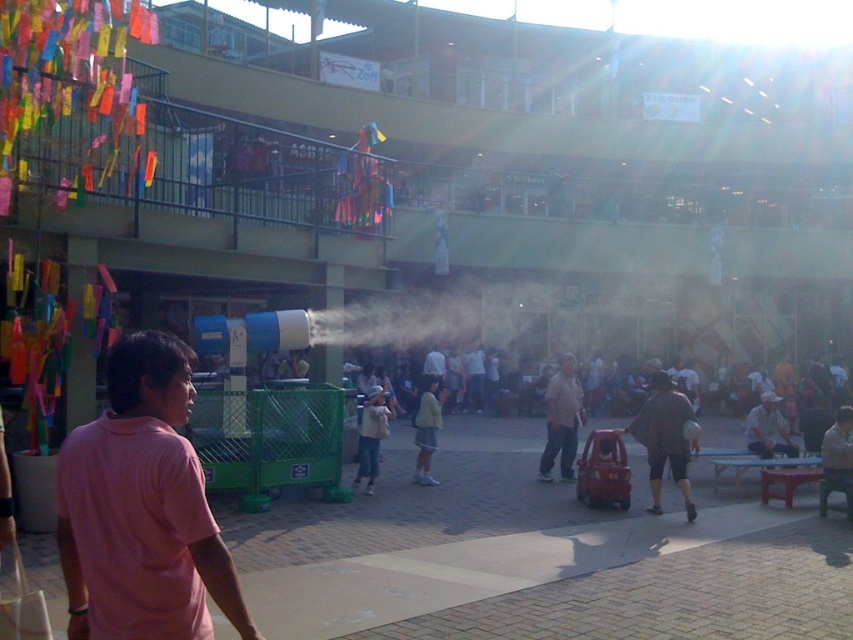
Question: Which object appears closest to the camera in this image?

Choices:
 (A) light brown fabric shirt at center
 (B) pink cotton shirt at center
 (C) light brown cotton shirt at center
 (D) dark gray fabric shirt at center

Answer: (B)

Question: Can you confirm if pink cotton shirt at center is thinner than light brown fabric shirt at center?

Choices:
 (A) no
 (B) yes

Answer: (A)

Question: Estimate the real-world distances between objects in this image. Which object is closer to the dark gray fabric shirt at center?

Choices:
 (A) light yellow fabric at center
 (B) light brown cotton shirt at center
 (C) light brown fabric shirt at center

Answer: (B)

Question: Does light brown cotton shirt at center have a greater width compared to light yellow fabric at center?

Choices:
 (A) no
 (B) yes

Answer: (B)

Question: Which point appears closest to the camera in this image?

Choices:
 (A) pyautogui.click(x=425, y=432)
 (B) pyautogui.click(x=368, y=408)

Answer: (B)

Question: In this image, where is dark gray fabric shirt at center located relative to light brown fabric shirt at center?

Choices:
 (A) below
 (B) above

Answer: (B)